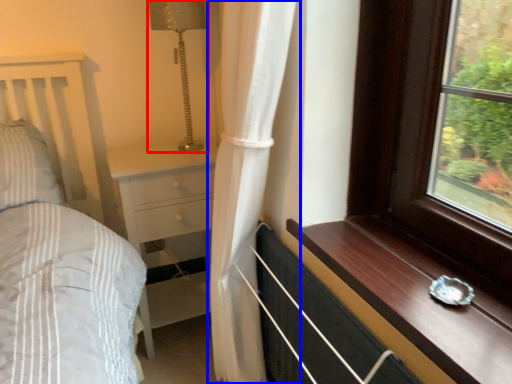
Question: Which point is closer to the camera, lamp (highlighted by a red box) or curtain (highlighted by a blue box)?

Choices:
 (A) lamp
 (B) curtain

Answer: (B)